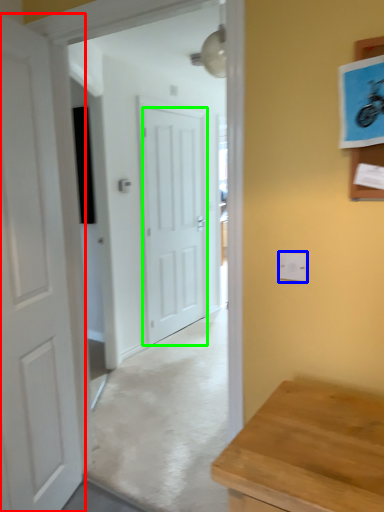
Question: Which object is positioned closest to door (highlighted by a red box)? Select from electric outlet (highlighted by a blue box) and door (highlighted by a green box).

Choices:
 (A) electric outlet
 (B) door

Answer: (A)